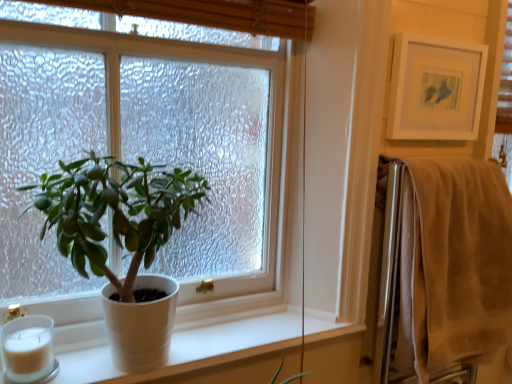
Locate an element on the screen. This screenshot has height=384, width=512. free space above white matte window sill at lower left (from a real-world perspective) is located at coordinates (224, 339).